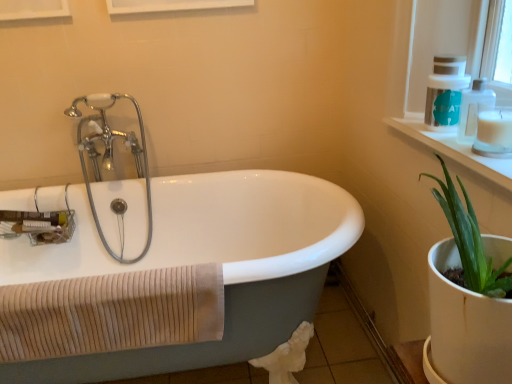
Question: Is white glossy shelf at upper right positioned with its back to beige ribbed towel at lower left?

Choices:
 (A) yes
 (B) no

Answer: (B)

Question: Is white glossy shelf at upper right smaller than beige ribbed towel at lower left?

Choices:
 (A) yes
 (B) no

Answer: (A)

Question: Is white glossy shelf at upper right positioned far away from beige ribbed towel at lower left?

Choices:
 (A) yes
 (B) no

Answer: (B)

Question: Considering the relative sizes of white glossy shelf at upper right and beige ribbed towel at lower left in the image provided, is white glossy shelf at upper right wider than beige ribbed towel at lower left?

Choices:
 (A) no
 (B) yes

Answer: (B)

Question: From a real-world perspective, is white glossy shelf at upper right below beige ribbed towel at lower left?

Choices:
 (A) no
 (B) yes

Answer: (A)

Question: Is white glossy shelf at upper right at the right side of beige ribbed towel at lower left?

Choices:
 (A) yes
 (B) no

Answer: (A)

Question: Is white glossy shelf at upper right wider than white plastic window frame at upper right?

Choices:
 (A) yes
 (B) no

Answer: (B)

Question: From the image's perspective, is white glossy shelf at upper right located beneath white plastic window frame at upper right?

Choices:
 (A) yes
 (B) no

Answer: (A)

Question: Can you confirm if white glossy shelf at upper right is shorter than white plastic window frame at upper right?

Choices:
 (A) yes
 (B) no

Answer: (A)

Question: Does white glossy shelf at upper right appear on the left side of white plastic window frame at upper right?

Choices:
 (A) no
 (B) yes

Answer: (A)

Question: Would you say white glossy shelf at upper right contains white plastic window frame at upper right?

Choices:
 (A) yes
 (B) no

Answer: (B)

Question: Can you confirm if white glossy shelf at upper right is bigger than white plastic window frame at upper right?

Choices:
 (A) no
 (B) yes

Answer: (A)

Question: From the image's perspective, is white plastic soap dispenser at upper right, the 1th soap dispenser viewed from the back, below white glossy bathtub at center?

Choices:
 (A) no
 (B) yes

Answer: (A)